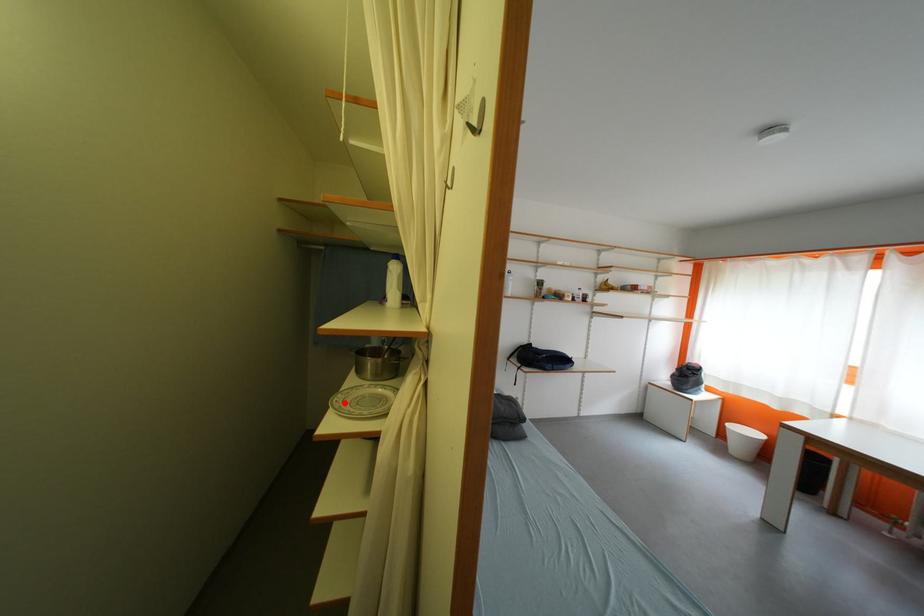
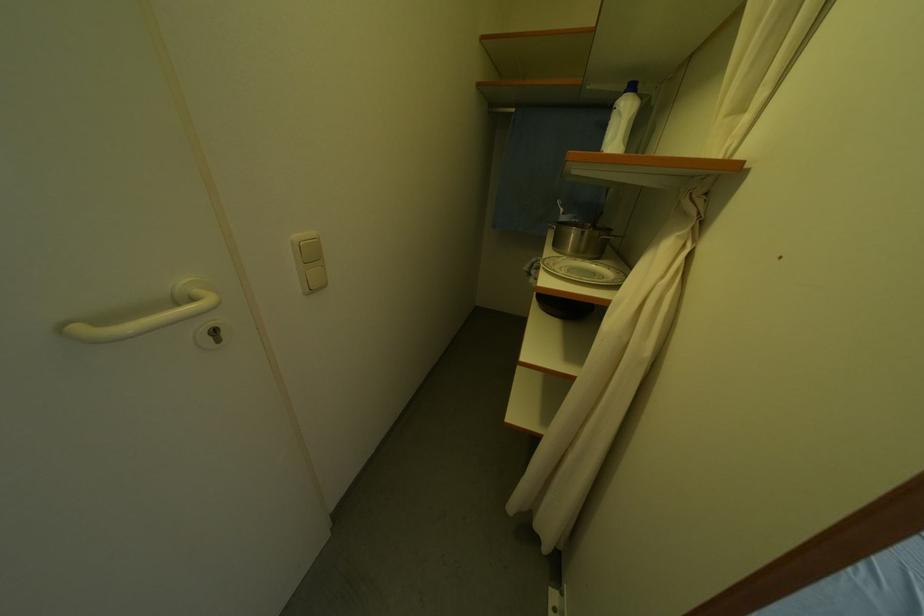
The point at the highlighted location is marked in the first image. Where is the corresponding point in the second image?

(554, 265)